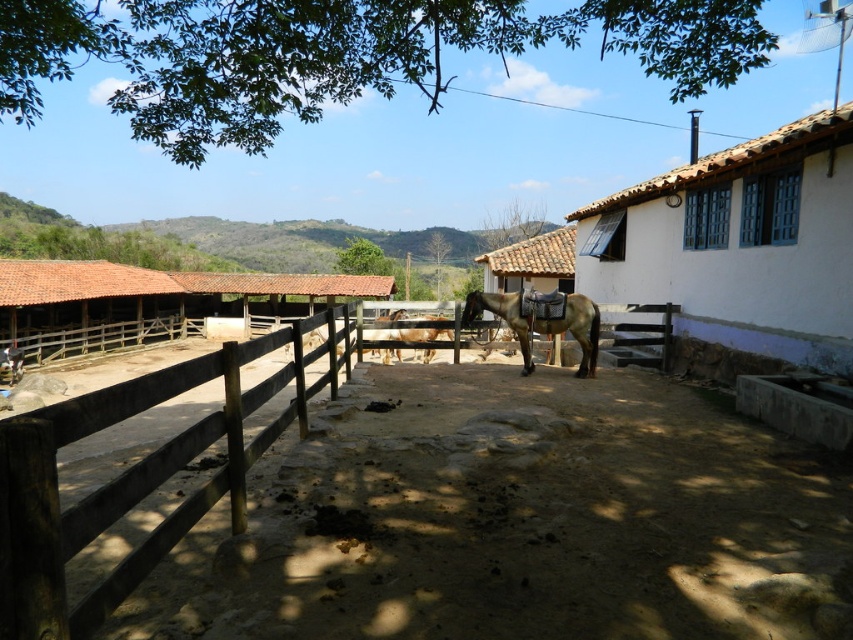
From the picture: You are standing in the rural scene looking at the fenced area with horses. There are two points marked in the image. Which point, point (328, 534) or point (183, 324), is closer to you?

Point (328, 534) is closer to the camera than point (183, 324).

You are a farmer who needs to move a heavy tractor from the brown tile hut at left to the brown sandy dirt field at center. Based on the scene, which direction should you drive the tractor to reach the field?

The brown sandy dirt field at center is to the right of the brown tile hut at left, so you should drive the tractor to the right to reach the field.